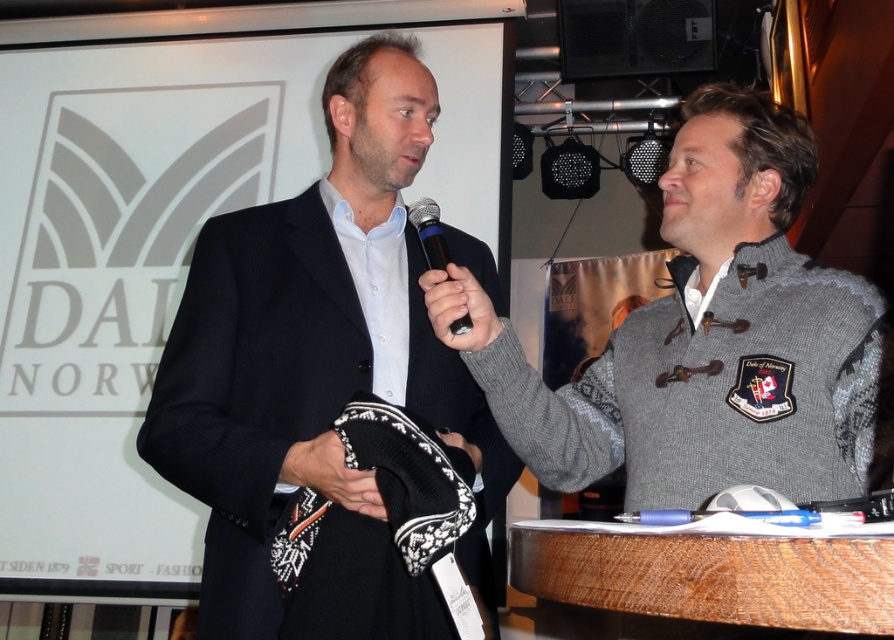
You are standing at the point marked as point (238, 582) in the image. If you want to move closer to the camera, which direction should you move?

Since the distance of point (238, 582) from the camera is 4.05 feet, moving towards the camera would require moving in the direction that decreases this distance. However, without additional spatial references, the exact direction can only be inferred based on standard coordinate systems. In most image coordinate systems, the origin is at the top left, so moving towards the camera might involve moving upwards or towards the center depending on context.

You are a photographer at the event and need to capture a photo where both the knitted gray sweater at center and the black plastic microphone at center are clearly visible. Based on their sizes, which object should you ensure is positioned closer to the camera to avoid being obscured?

The knitted gray sweater at center is taller than the black plastic microphone at center, so you should position the black plastic microphone at center closer to the camera to prevent it from being obscured by the taller sweater.